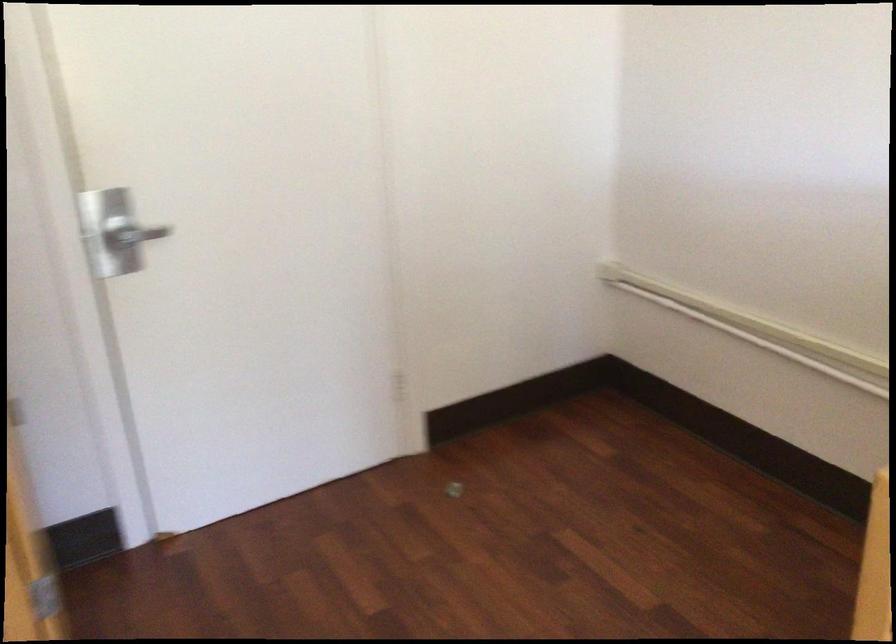
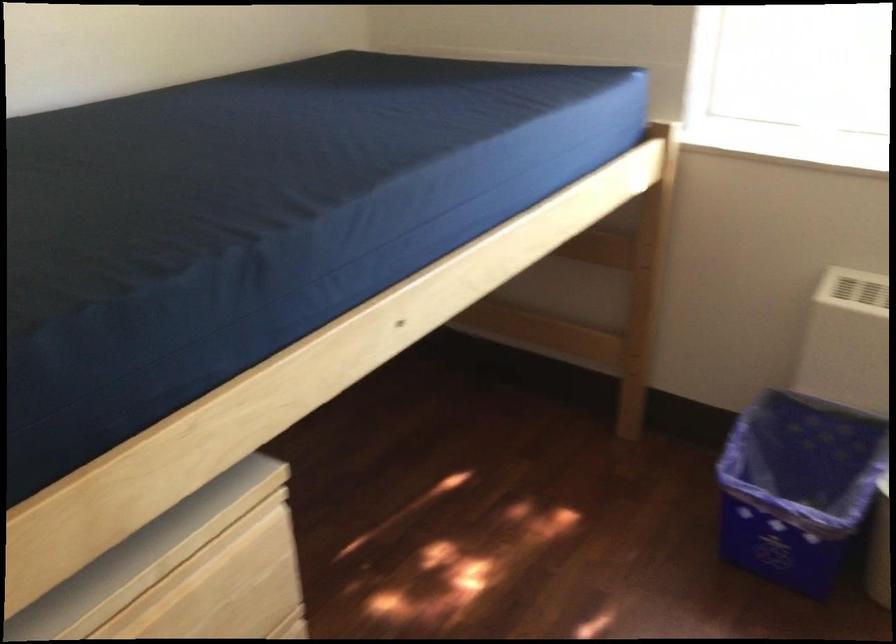
Based on the continuous images, in which direction is the camera rotating?

The camera's rotation is toward right-down.